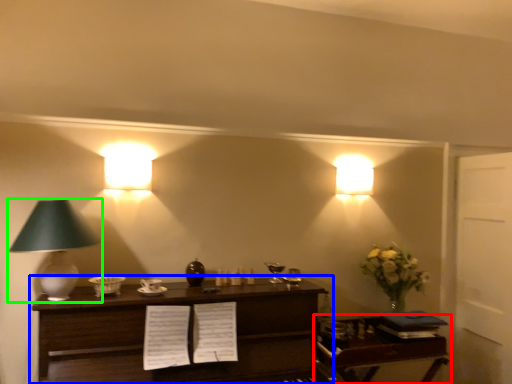
Question: Which object is positioned farthest from table (highlighted by a red box)? Select from table (highlighted by a blue box) and lamp (highlighted by a green box).

Choices:
 (A) table
 (B) lamp

Answer: (B)